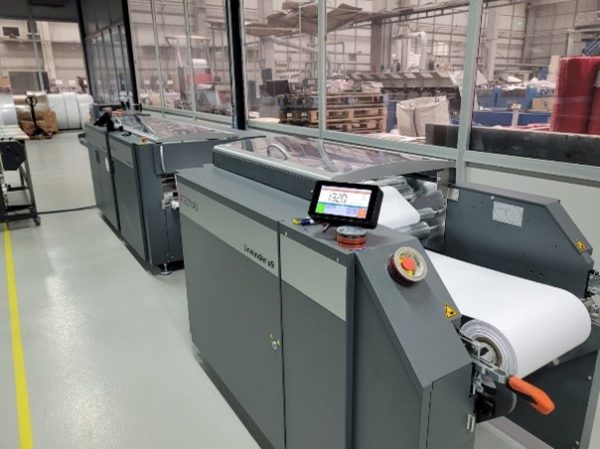
Where is `paper roll`? paper roll is located at coordinates pyautogui.click(x=500, y=342).